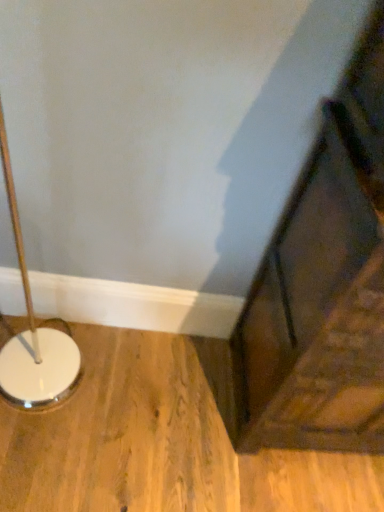
At what (x,y) coordinates should I click in order to perform the action: click on wooden bed frame at right. Please return your answer as a coordinate pair (x, y). Looking at the image, I should click on (324, 286).

The image size is (384, 512). What do you see at coordinates (324, 286) in the screenshot? I see `wooden bed frame at right` at bounding box center [324, 286].

Image resolution: width=384 pixels, height=512 pixels. What are the coordinates of `wooden bed frame at right` in the screenshot? It's located at (324, 286).